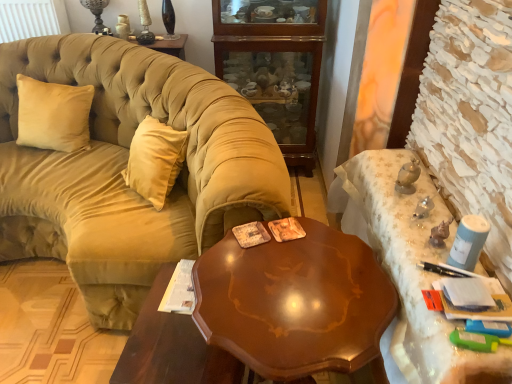
Question: From a real-world perspective, is shiny brown wood table at center, which ranks as the 1th desk in left-to-right order, above or below velvet beige couch at left?

Choices:
 (A) above
 (B) below

Answer: (B)

Question: From the image's perspective, is shiny brown wood table at center, which ranks as the 1th desk in left-to-right order, positioned above or below velvet beige couch at left?

Choices:
 (A) below
 (B) above

Answer: (A)

Question: Estimate the real-world distances between objects in this image. Which object is farther from the beige velvet pillow at left?

Choices:
 (A) white lace tablecloth at right, which ranks as the 2th desk in left-to-right order
 (B) glossy wood table at center
 (C) shiny brown wood table at center, which appears as the 2th desk when viewed from the right
 (D) wooden cabinet at center
 (E) velvet beige couch at left

Answer: (A)

Question: Which of these objects is positioned closest to the shiny brown wood table at center, which ranks as the 1th desk in left-to-right order?

Choices:
 (A) beige velvet pillow at left
 (B) white lace tablecloth at right, which ranks as the 2th desk in left-to-right order
 (C) velvet beige couch at left
 (D) wooden cabinet at center
 (E) glossy wood table at center

Answer: (E)